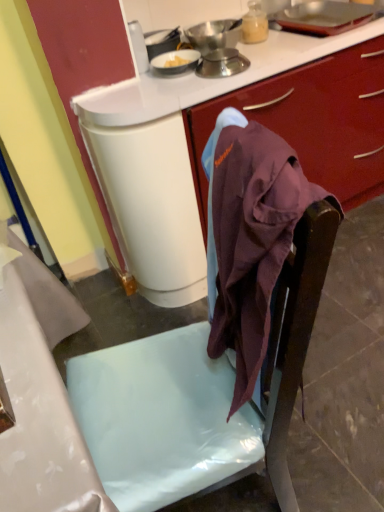
Question: Is matte plastic chair at center positioned before metallic silver bowl at upper center, which is counted as the first kitchen appliance, starting from the top?

Choices:
 (A) yes
 (B) no

Answer: (A)

Question: From a real-world perspective, does matte plastic chair at center sit lower than metallic silver bowl at upper center, the second kitchen appliance positioned from the bottom?

Choices:
 (A) no
 (B) yes

Answer: (B)

Question: Can you confirm if matte plastic chair at center is taller than metallic silver bowl at upper center, the second kitchen appliance positioned from the bottom?

Choices:
 (A) no
 (B) yes

Answer: (A)

Question: Is the surface of matte plastic chair at center in direct contact with metallic silver bowl at upper center, which is counted as the first kitchen appliance, starting from the top?

Choices:
 (A) no
 (B) yes

Answer: (A)

Question: Is matte plastic chair at center not within metallic silver bowl at upper center, the second kitchen appliance positioned from the bottom?

Choices:
 (A) no
 (B) yes

Answer: (B)

Question: In terms of size, does metallic silver scale at upper center, the first kitchen appliance from the bottom, appear bigger or smaller than metallic silver bowl at upper center, the second kitchen appliance positioned from the bottom?

Choices:
 (A) big
 (B) small

Answer: (B)

Question: From a real-world perspective, is metallic silver scale at upper center, placed as the 2th kitchen appliance when sorted from top to bottom, positioned above or below metallic silver bowl at upper center, the second kitchen appliance positioned from the bottom?

Choices:
 (A) below
 (B) above

Answer: (A)

Question: Based on their positions, is metallic silver scale at upper center, placed as the 2th kitchen appliance when sorted from top to bottom, located to the left or right of metallic silver bowl at upper center, which is counted as the first kitchen appliance, starting from the top?

Choices:
 (A) left
 (B) right

Answer: (B)

Question: Looking at their shapes, would you say metallic silver scale at upper center, the first kitchen appliance from the bottom, is wider or thinner than metallic silver bowl at upper center, the second kitchen appliance positioned from the bottom?

Choices:
 (A) thin
 (B) wide

Answer: (A)

Question: Is metallic silver bowl at upper center, which is counted as the first kitchen appliance, starting from the top, taller or shorter than matte plastic chair at center?

Choices:
 (A) short
 (B) tall

Answer: (B)

Question: Looking at their shapes, would you say metallic silver bowl at upper center, the second kitchen appliance positioned from the bottom, is wider or thinner than matte plastic chair at center?

Choices:
 (A) thin
 (B) wide

Answer: (A)

Question: Is metallic silver bowl at upper center, the second kitchen appliance positioned from the bottom, in front of or behind matte plastic chair at center in the image?

Choices:
 (A) behind
 (B) front

Answer: (A)

Question: Is point (223, 23) closer or farther from the camera than point (102, 387)?

Choices:
 (A) closer
 (B) farther

Answer: (B)

Question: Is purple fabric at center wider or thinner than metallic silver bowl at upper center, which is counted as the first kitchen appliance, starting from the top?

Choices:
 (A) thin
 (B) wide

Answer: (B)

Question: Considering their positions, is purple fabric at center located in front of or behind metallic silver bowl at upper center, the second kitchen appliance positioned from the bottom?

Choices:
 (A) front
 (B) behind

Answer: (A)